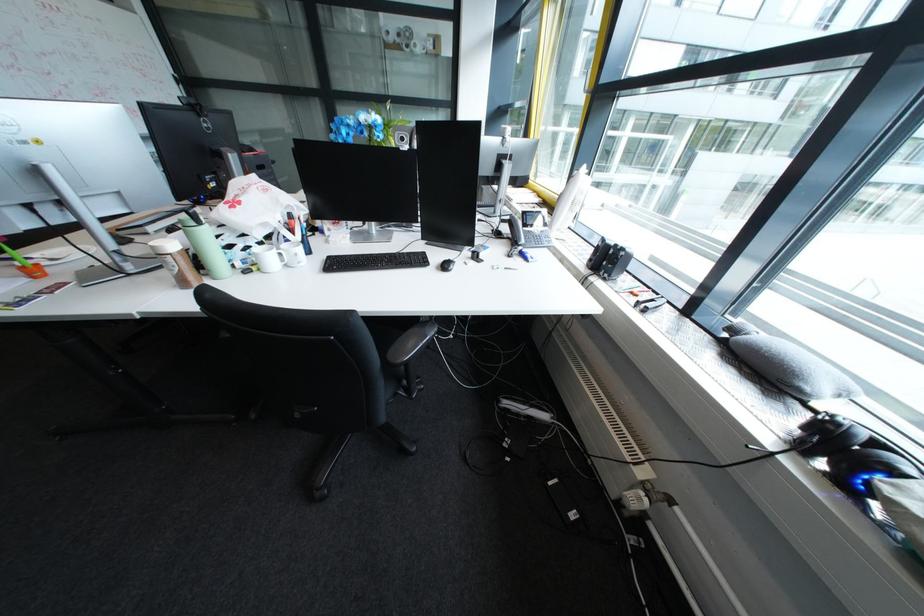
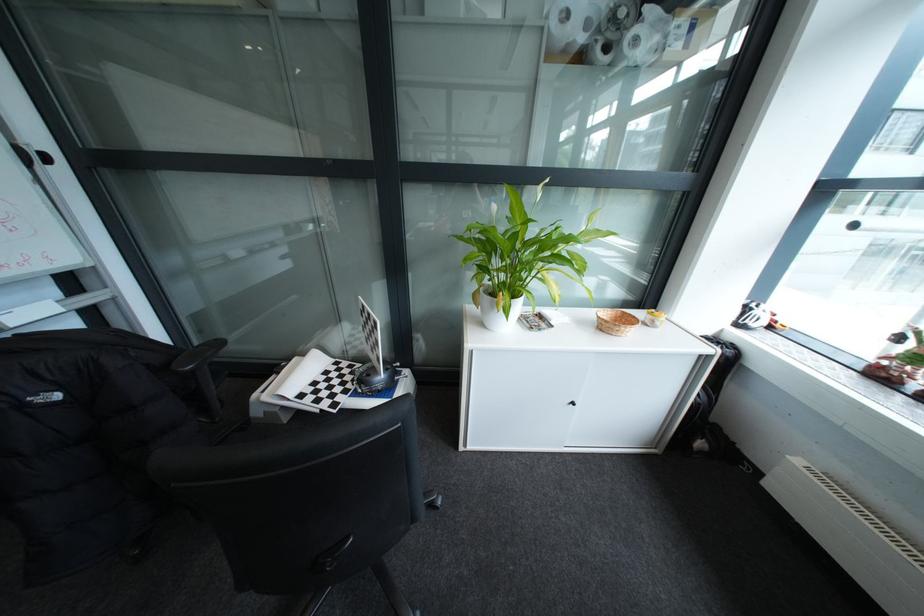
In the scene shown: In a continuous first-person perspective shot, in which direction is the camera moving?

The movement direction of the cameraman is left, forward.